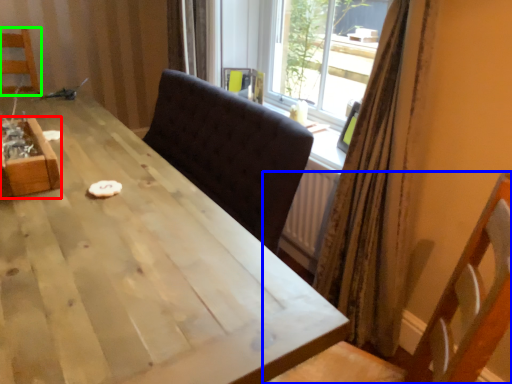
Question: Which object is positioned closest to crate (highlighted by a red box)? Select from chair (highlighted by a blue box) and chair (highlighted by a green box).

Choices:
 (A) chair
 (B) chair

Answer: (A)